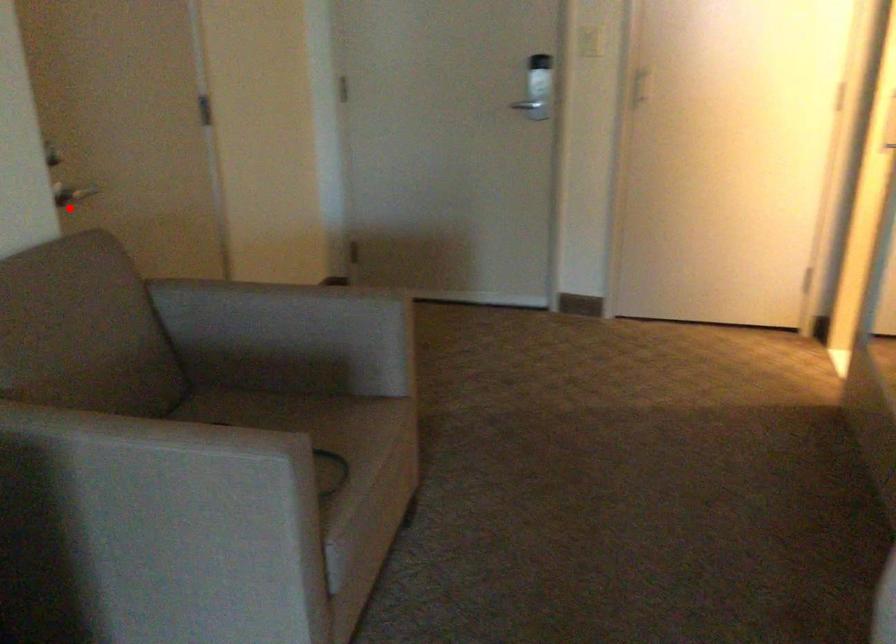
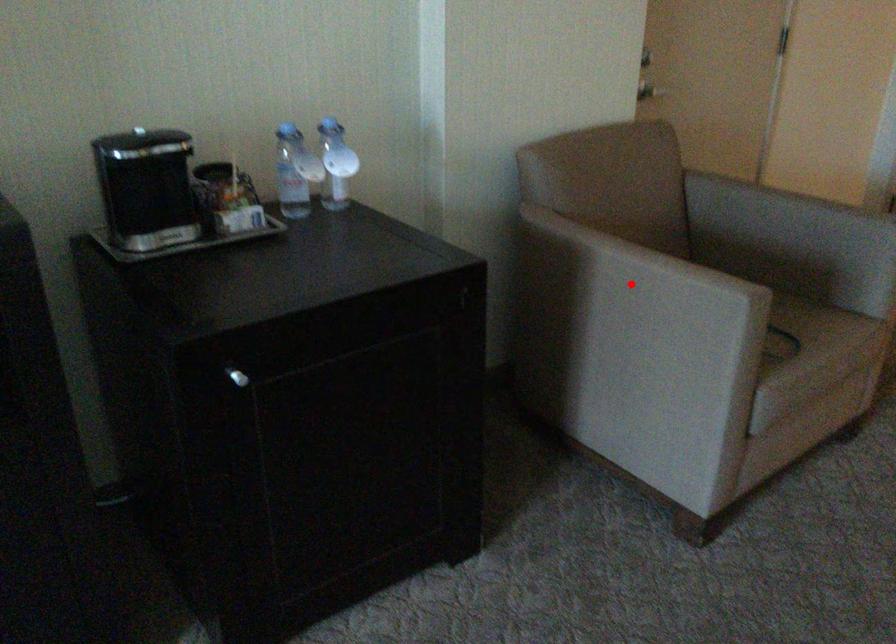
I am providing you with two images of the same scene from different viewpoints. A red point is marked on the first image and another point is marked on the second image. Are the points marked in image1 and image2 representing the same 3D position?

No